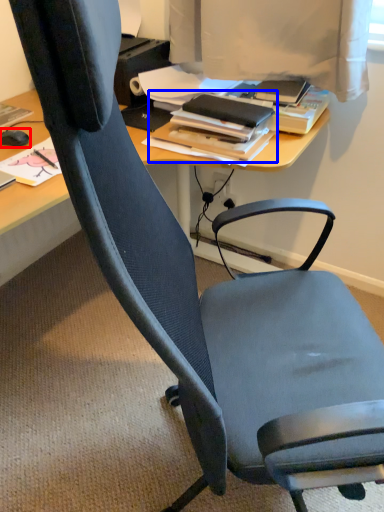
Question: Among these objects, which one is nearest to the camera, mouse (highlighted by a red box) or book (highlighted by a blue box)?

Choices:
 (A) mouse
 (B) book

Answer: (B)